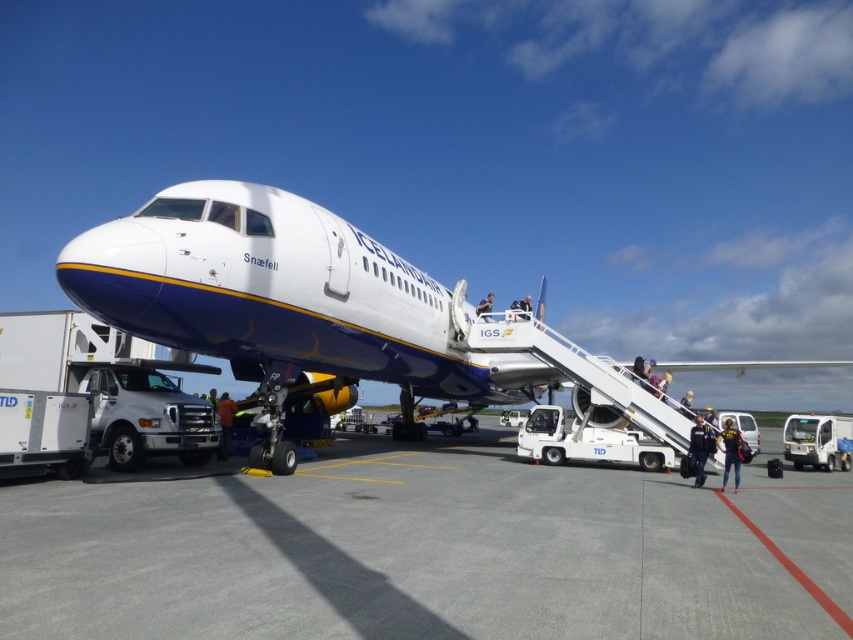
You are a passenger trying to board the Icelandair plane. You see the gray concrete tarmac at center and the orange reflective vest at lower center. Which object is closer to the ground?

The gray concrete tarmac at center is closer to the ground because it is not as tall as the orange reflective vest at lower center.

You are an airport staff member observing the Icelandair aircraft on the tarmac. You notice two pieces of clothing near the boarding area. The first is a dark blue uniform at center, and the second is a blue fabric jacket at upper center. Which clothing item appears smaller in size?

The dark blue uniform at center is smaller than the blue fabric jacket at upper center, so the dark blue uniform at center appears smaller in size.